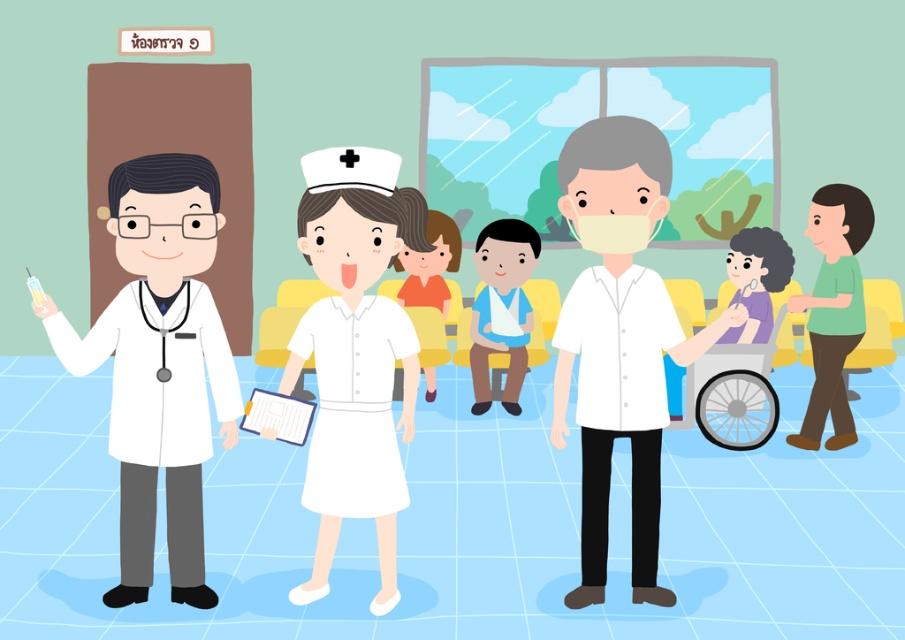
Question: Is white matte shirt at center above green matte shirt at right?

Choices:
 (A) yes
 (B) no

Answer: (B)

Question: Among these objects, which one is farthest from the camera?

Choices:
 (A) green matte shirt at right
 (B) white matte doctor coat at left
 (C) white matte shirt at center

Answer: (A)

Question: Is white matte doctor coat at left wider than green matte shirt at right?

Choices:
 (A) yes
 (B) no

Answer: (A)

Question: Which point appears closest to the camera in this image?

Choices:
 (A) [x=148, y=474]
 (B) [x=846, y=406]

Answer: (A)

Question: Estimate the real-world distances between objects in this image. Which object is closer to the white matte shirt at center?

Choices:
 (A) white matte doctor coat at left
 (B) green matte shirt at right

Answer: (A)

Question: Is white matte doctor coat at left to the left of green matte shirt at right from the viewer's perspective?

Choices:
 (A) no
 (B) yes

Answer: (B)